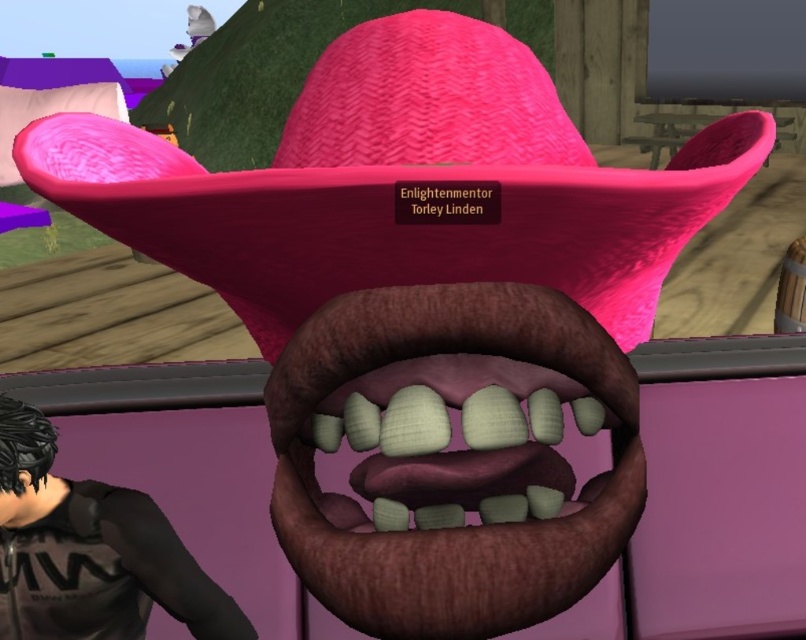
You are a virtual assistant in a 3D simulation. You need to place a 12 inch wide decorative item between the pink woven hat at center and the black matte shirt at lower left. Is there enough space between them to fit the item?

The pink woven hat at center and black matte shirt at lower left are 35.43 inches apart from each other. Since the decorative item is 12 inches wide, there is sufficient space between them to fit the item as 35.43 inches is greater than 12 inches.